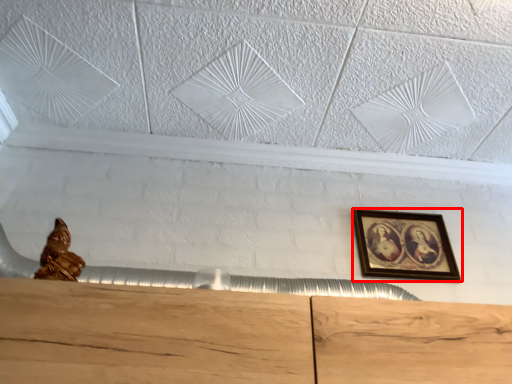
Question: From the image's perspective, what is the correct spatial relationship of picture frame (annotated by the red box) in relation to sculpture?

Choices:
 (A) below
 (B) above

Answer: (A)